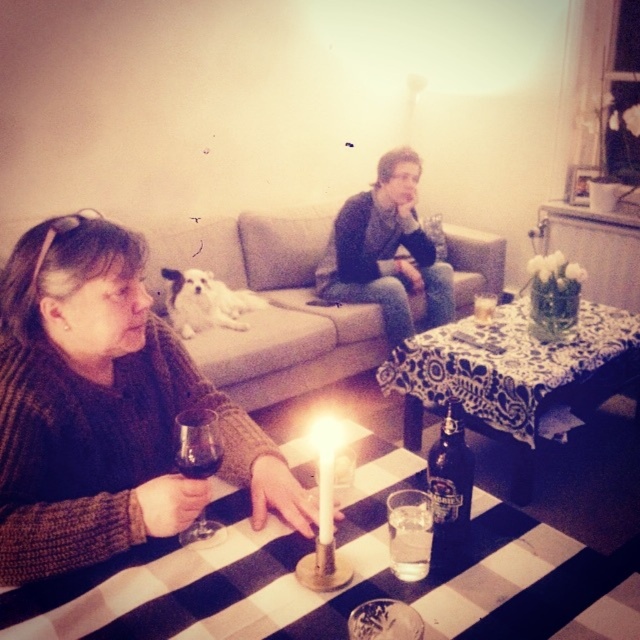
Is point (484, 397) closer to camera compared to point (428, 490)?

No, it is behind (428, 490).

Measure the distance between white lace tablecloth at center and camera.

white lace tablecloth at center is 7.04 feet from camera.

Is point (481, 365) positioned before point (442, 536)?

No, (481, 365) is behind (442, 536).

You are a GUI agent. You are given a task and a screenshot of the screen. Output one action in this format:
    pyautogui.click(x=<x>, y=<y>)
    Task: Click on the white lace tablecloth at center
    The image size is (640, 640).
    Given the screenshot: What is the action you would take?
    pyautogui.click(x=515, y=376)

Can you confirm if white lace tablecloth at center is wider than white wax candle at center?

Correct, the width of white lace tablecloth at center exceeds that of white wax candle at center.

Does white lace tablecloth at center lie in front of white wax candle at center?

That is False.

Is point (458, 385) behind point (321, 500)?

That is True.

At what (x,y) coordinates should I click in order to perform the action: click on white lace tablecloth at center. Please return your answer as a coordinate pair (x, y). The height and width of the screenshot is (640, 640). Looking at the image, I should click on (515, 376).

Does gray fabric couch at center come behind transparent glass at lower left?

Yes, gray fabric couch at center is further from the viewer.

Can you confirm if gray fabric couch at center is smaller than transparent glass at lower left?

Incorrect, gray fabric couch at center is not smaller in size than transparent glass at lower left.

Who is more forward, [298,256] or [193,426]?

Point [193,426] is in front.

At what (x,y) coordinates should I click in order to perform the action: click on gray fabric couch at center. Please return your answer as a coordinate pair (x, y). The height and width of the screenshot is (640, 640). Looking at the image, I should click on (269, 305).